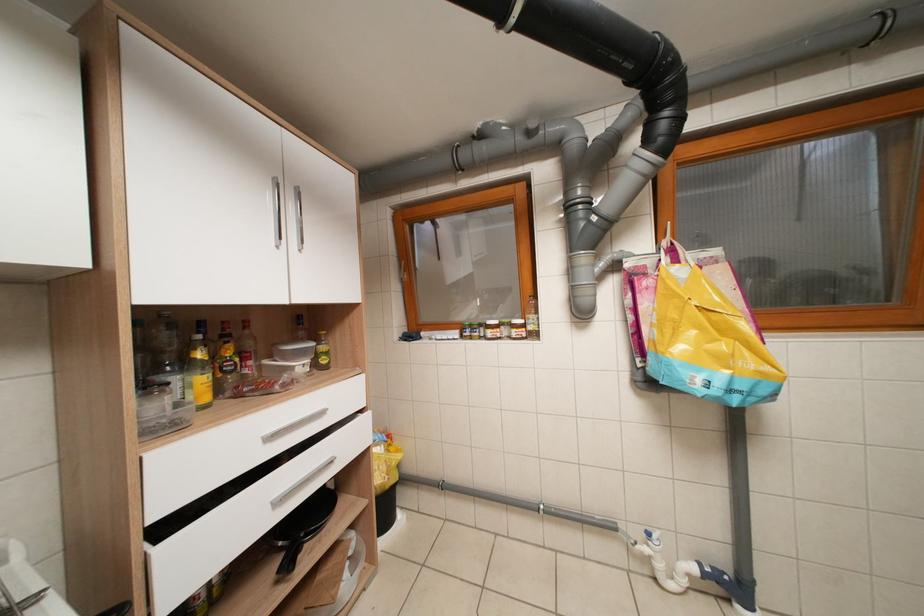
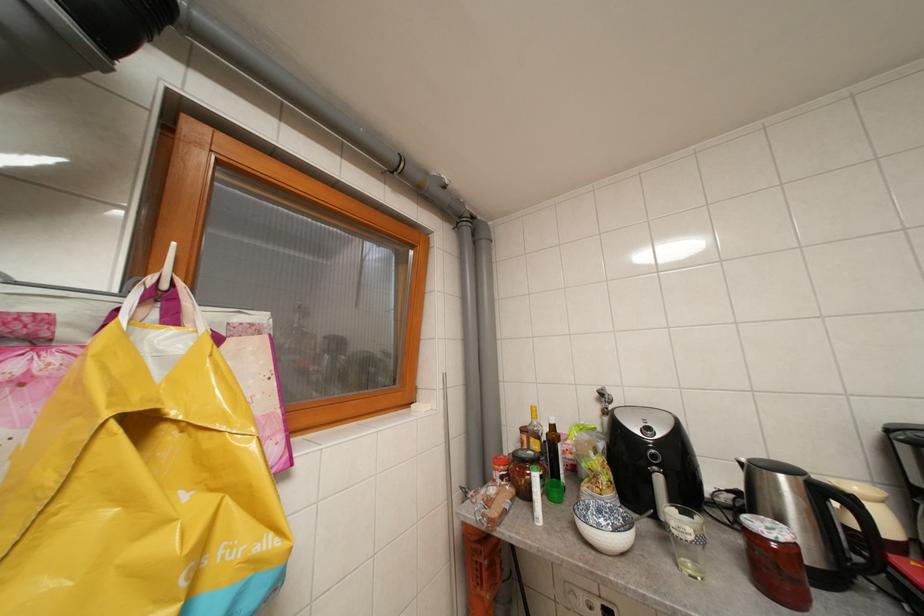
Question: The camera is either moving clockwise (left) or counter-clockwise (right) around the object. The first image is from the beginning of the video and the second image is from the end. Is the camera moving left or right when shooting the video?

Choices:
 (A) Left
 (B) Right

Answer: (A)